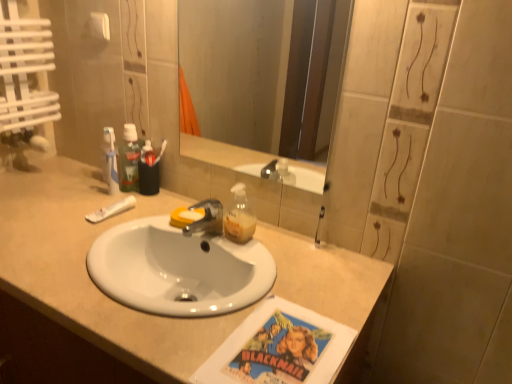
This screenshot has width=512, height=384. I want to click on free region on the left part of metallic silver tap at center, so click(137, 226).